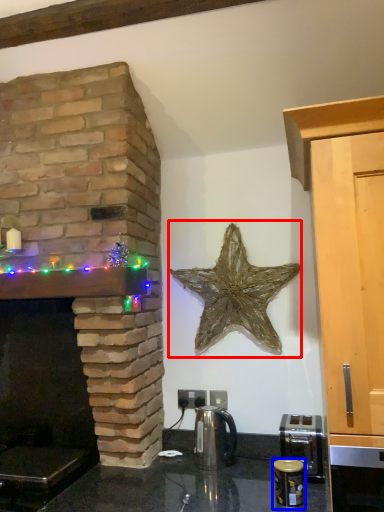
Question: Which point is further to the camera, starfish (highlighted by a red box) or appliance (highlighted by a blue box)?

Choices:
 (A) starfish
 (B) appliance

Answer: (A)